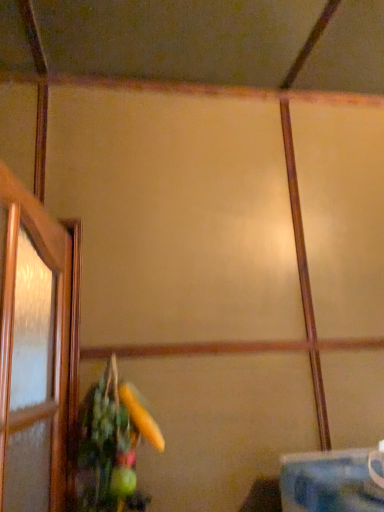
In the scene shown: What is the approximate height of green matte floral arrangement at lower left?

green matte floral arrangement at lower left is 39.17 centimeters in height.

This screenshot has height=512, width=384. Describe the element at coordinates (111, 445) in the screenshot. I see `green matte floral arrangement at lower left` at that location.

Where is `green matte floral arrangement at lower left`? This screenshot has height=512, width=384. green matte floral arrangement at lower left is located at coordinates (111, 445).

The width and height of the screenshot is (384, 512). What do you see at coordinates (329, 482) in the screenshot? I see `blue fabric table at lower right` at bounding box center [329, 482].

I want to click on blue fabric table at lower right, so pos(329,482).

Measure the distance between point (288, 501) and camera.

The depth of point (288, 501) is 35.75 inches.

Where is `green matte floral arrangement at lower left`? This screenshot has width=384, height=512. green matte floral arrangement at lower left is located at coordinates (111, 445).

Looking at this image, which object is positioned more to the left, green matte floral arrangement at lower left or blue fabric table at lower right?

green matte floral arrangement at lower left is more to the left.

In the scene shown: Does green matte floral arrangement at lower left come in front of blue fabric table at lower right?

No, it is not.

Between point (95, 508) and point (367, 499), which one is positioned in front?

The point (367, 499) is closer.

From the image's perspective, is green matte floral arrangement at lower left located above blue fabric table at lower right?

Indeed, from the image's perspective, green matte floral arrangement at lower left is shown above blue fabric table at lower right.

From a real-world perspective, is green matte floral arrangement at lower left located higher than blue fabric table at lower right?

Correct, in the physical world, green matte floral arrangement at lower left is higher than blue fabric table at lower right.

Which of these two, green matte floral arrangement at lower left or blue fabric table at lower right, is wider?

blue fabric table at lower right is wider.

Considering the relative sizes of green matte floral arrangement at lower left and blue fabric table at lower right in the image provided, is green matte floral arrangement at lower left shorter than blue fabric table at lower right?

No, green matte floral arrangement at lower left is not shorter than blue fabric table at lower right.

Is green matte floral arrangement at lower left bigger than blue fabric table at lower right?

Correct, green matte floral arrangement at lower left is larger in size than blue fabric table at lower right.

Is green matte floral arrangement at lower left outside of blue fabric table at lower right?

Indeed, green matte floral arrangement at lower left is completely outside blue fabric table at lower right.

Are green matte floral arrangement at lower left and blue fabric table at lower right beside each other?

There is a gap between green matte floral arrangement at lower left and blue fabric table at lower right.

Is green matte floral arrangement at lower left looking in the opposite direction of blue fabric table at lower right?

No, blue fabric table at lower right is not at the back of green matte floral arrangement at lower left.

In the scene shown: What's the angular difference between green matte floral arrangement at lower left and blue fabric table at lower right's facing directions?

They differ by 92.3 degrees in their facing directions.

Find the location of a particular element. The height and width of the screenshot is (512, 384). table on the right of green matte floral arrangement at lower left is located at coordinates (329, 482).

Considering the relative positions of blue fabric table at lower right and green matte floral arrangement at lower left in the image provided, is blue fabric table at lower right to the left of green matte floral arrangement at lower left from the viewer's perspective?

Incorrect, blue fabric table at lower right is not on the left side of green matte floral arrangement at lower left.

Is blue fabric table at lower right positioned behind green matte floral arrangement at lower left?

No.

Is point (330, 460) closer or farther from the camera than point (89, 400)?

Point (330, 460).

From the image's perspective, is blue fabric table at lower right beneath green matte floral arrangement at lower left?

Correct, blue fabric table at lower right appears lower than green matte floral arrangement at lower left in the image.

From a real-world perspective, is blue fabric table at lower right positioned under green matte floral arrangement at lower left based on gravity?

Yes, from a real-world perspective, blue fabric table at lower right is beneath green matte floral arrangement at lower left.

Which of these two, blue fabric table at lower right or green matte floral arrangement at lower left, is wider?

blue fabric table at lower right.

Does blue fabric table at lower right have a lesser height compared to green matte floral arrangement at lower left?

Yes, blue fabric table at lower right is shorter than green matte floral arrangement at lower left.

Looking at this image, who is bigger, blue fabric table at lower right or green matte floral arrangement at lower left?

green matte floral arrangement at lower left.

Does blue fabric table at lower right contain green matte floral arrangement at lower left?

No, green matte floral arrangement at lower left is located outside of blue fabric table at lower right.

Are blue fabric table at lower right and green matte floral arrangement at lower left located far from each other?

No, blue fabric table at lower right is not far away from green matte floral arrangement at lower left.

Could you tell me if blue fabric table at lower right is facing green matte floral arrangement at lower left?

No, blue fabric table at lower right is not turned towards green matte floral arrangement at lower left.

Consider the image. How many degrees apart are the facing directions of blue fabric table at lower right and green matte floral arrangement at lower left?

The facing directions of blue fabric table at lower right and green matte floral arrangement at lower left are 92.3 degrees apart.

This screenshot has height=512, width=384. Find the location of `floral arrangement that is on the left side of blue fabric table at lower right`. floral arrangement that is on the left side of blue fabric table at lower right is located at coordinates (111, 445).

Locate an element on the screen. floral arrangement above the blue fabric table at lower right (from the image's perspective) is located at coordinates (111, 445).

Where is `floral arrangement behind the blue fabric table at lower right`? Image resolution: width=384 pixels, height=512 pixels. floral arrangement behind the blue fabric table at lower right is located at coordinates (111, 445).